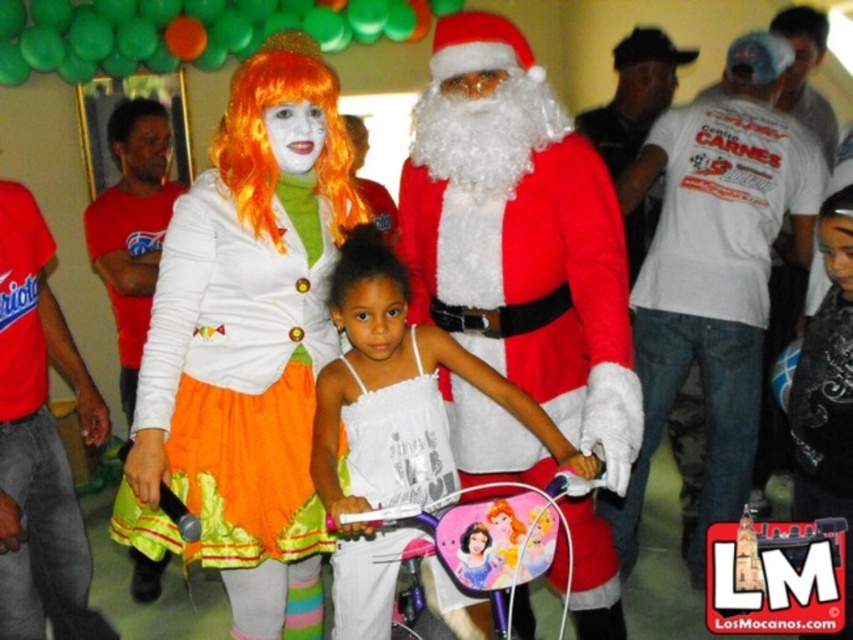
Is velvet red santa suit at center to the right of white lace dress at center from the viewer's perspective?

Yes, velvet red santa suit at center is to the right of white lace dress at center.

What do you see at coordinates (519, 236) in the screenshot? I see `velvet red santa suit at center` at bounding box center [519, 236].

Is point (601, 417) less distant than point (354, 426)?

Yes, point (601, 417) is closer to viewer.

This screenshot has width=853, height=640. I want to click on velvet red santa suit at center, so click(x=519, y=236).

Between white lace dress at center and orange synthetic wig at upper center, which one is positioned lower?

Positioned lower is white lace dress at center.

Is white lace dress at center to the left of orange synthetic wig at upper center from the viewer's perspective?

In fact, white lace dress at center is to the right of orange synthetic wig at upper center.

Between point (426, 481) and point (300, 86), which one is positioned behind?

Point (426, 481)

I want to click on white lace dress at center, so click(x=398, y=438).

Between matte orange dress at center and red t-shirt at left, which one appears on the left side from the viewer's perspective?

red t-shirt at left

Who is more distant from viewer, (320, 614) or (12, 292)?

The point (320, 614) is more distant.

At what (x,y) coordinates should I click in order to perform the action: click on matte orange dress at center. Please return your answer as a coordinate pair (x, y). The width and height of the screenshot is (853, 640). Looking at the image, I should click on (247, 346).